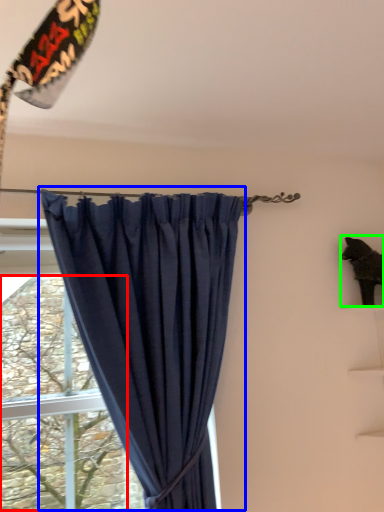
Question: Estimate the real-world distances between objects in this image. Which object is closer to tree (highlighted by a red box), curtain (highlighted by a blue box) or animal (highlighted by a green box)?

Choices:
 (A) curtain
 (B) animal

Answer: (A)